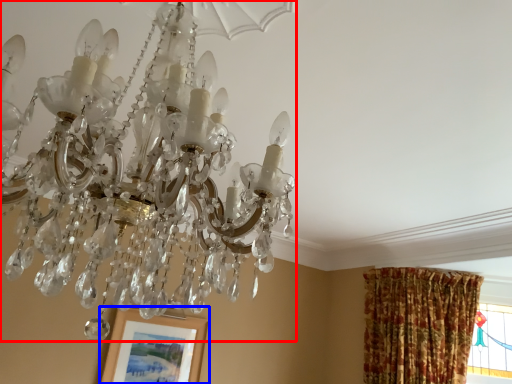
Question: Which point is closer to the camera, lamp (highlighted by a red box) or picture frame (highlighted by a blue box)?

Choices:
 (A) lamp
 (B) picture frame

Answer: (A)